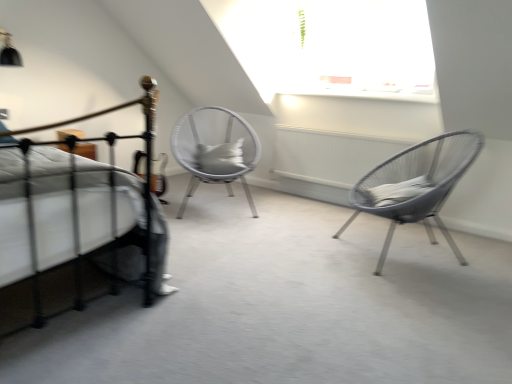
Question: Is metallic wire chair at right, which is counted as the second chair, starting from the left, far away from white woven chair at center, the 2th chair positioned from the right?

Choices:
 (A) yes
 (B) no

Answer: (A)

Question: Is metallic wire chair at right, the first chair in the front-to-back sequence, at the right side of white woven chair at center, the first chair from the back?

Choices:
 (A) no
 (B) yes

Answer: (B)

Question: Does metallic wire chair at right, which is counted as the second chair, starting from the left, have a greater width compared to white woven chair at center, acting as the 2th chair starting from the front?

Choices:
 (A) yes
 (B) no

Answer: (A)

Question: Is metallic wire chair at right, which is counted as the second chair, starting from the left, taller than white woven chair at center, the 2th chair positioned from the right?

Choices:
 (A) yes
 (B) no

Answer: (B)

Question: Considering the relative sizes of metallic wire chair at right, arranged as the first chair when viewed from the right, and white woven chair at center, the first chair from the back, in the image provided, is metallic wire chair at right, arranged as the first chair when viewed from the right, thinner than white woven chair at center, the first chair from the back,?

Choices:
 (A) no
 (B) yes

Answer: (A)

Question: Is metallic wire chair at right, the 2th chair in the back-to-front sequence, in contact with white woven chair at center, the first chair from the back?

Choices:
 (A) yes
 (B) no

Answer: (B)

Question: Does metallic wire chair at right, arranged as the first chair when viewed from the right, have a lesser height compared to gray fabric pillow at center?

Choices:
 (A) no
 (B) yes

Answer: (A)

Question: Does metallic wire chair at right, the first chair in the front-to-back sequence, have a greater height compared to gray fabric pillow at center?

Choices:
 (A) yes
 (B) no

Answer: (A)

Question: Is there a large distance between metallic wire chair at right, the first chair in the front-to-back sequence, and gray fabric pillow at center?

Choices:
 (A) yes
 (B) no

Answer: (A)

Question: From a real-world perspective, does metallic wire chair at right, which is counted as the second chair, starting from the left, stand above gray fabric pillow at center?

Choices:
 (A) no
 (B) yes

Answer: (A)

Question: Considering the relative sizes of metallic wire chair at right, the 2th chair in the back-to-front sequence, and gray fabric pillow at center in the image provided, is metallic wire chair at right, the 2th chair in the back-to-front sequence, thinner than gray fabric pillow at center?

Choices:
 (A) yes
 (B) no

Answer: (B)

Question: Is metallic wire chair at right, the first chair in the front-to-back sequence, beside gray fabric pillow at center?

Choices:
 (A) yes
 (B) no

Answer: (B)

Question: Can you confirm if white woven chair at center, acting as the 2th chair starting from the front, is wider than metallic wire chair at right, the first chair in the front-to-back sequence?

Choices:
 (A) no
 (B) yes

Answer: (A)